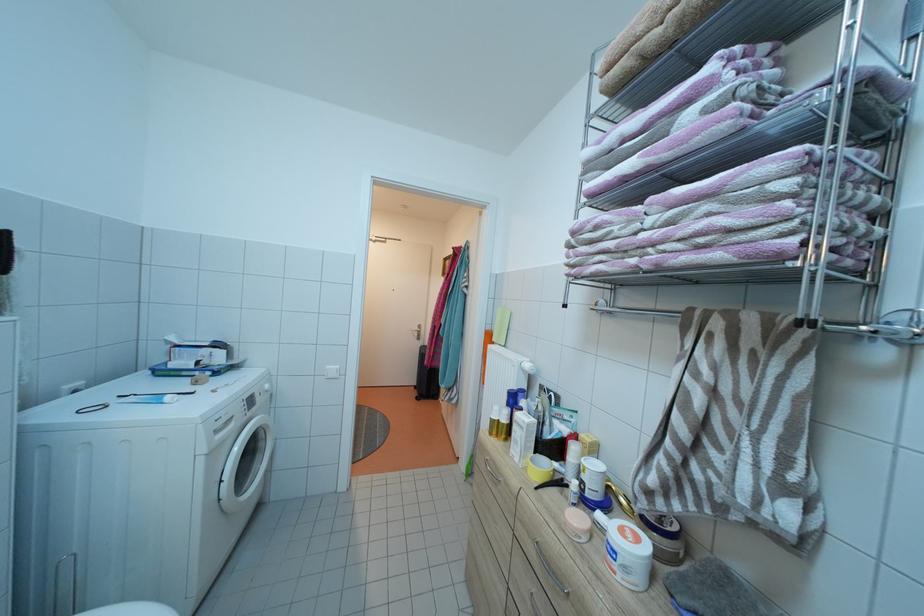
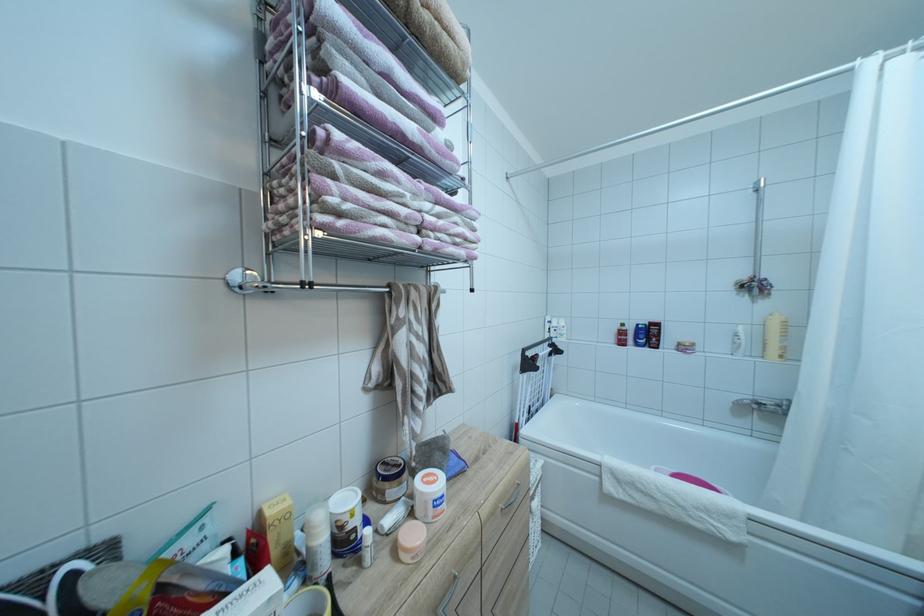
The point at (666, 233) is marked in the first image. Where is the corresponding point in the second image?

(440, 221)